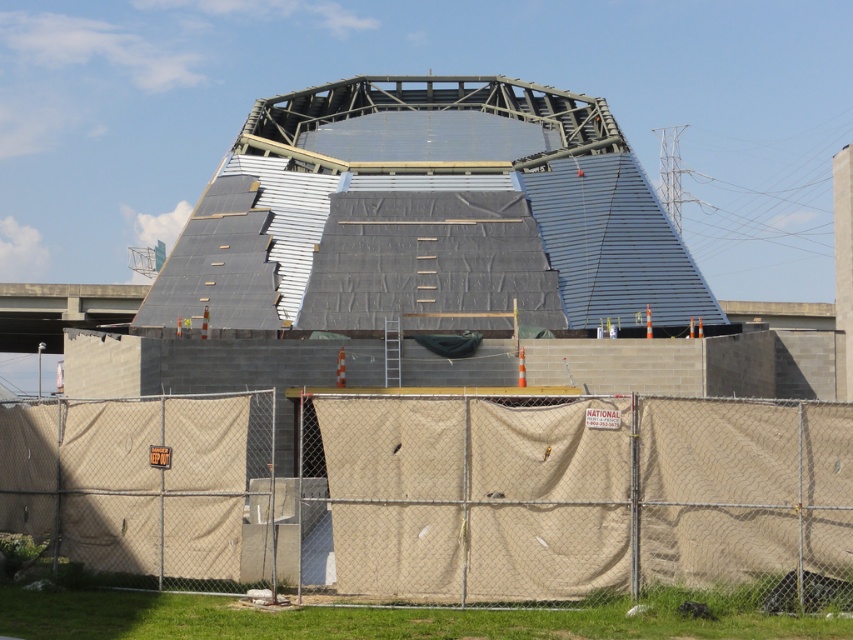
Between beige fabric fence at lower center and concrete bridge at left, which one appears on the left side from the viewer's perspective?

concrete bridge at left

What do you see at coordinates (447, 493) in the screenshot?
I see `beige fabric fence at lower center` at bounding box center [447, 493].

Identify the location of beige fabric fence at lower center. [x=447, y=493].